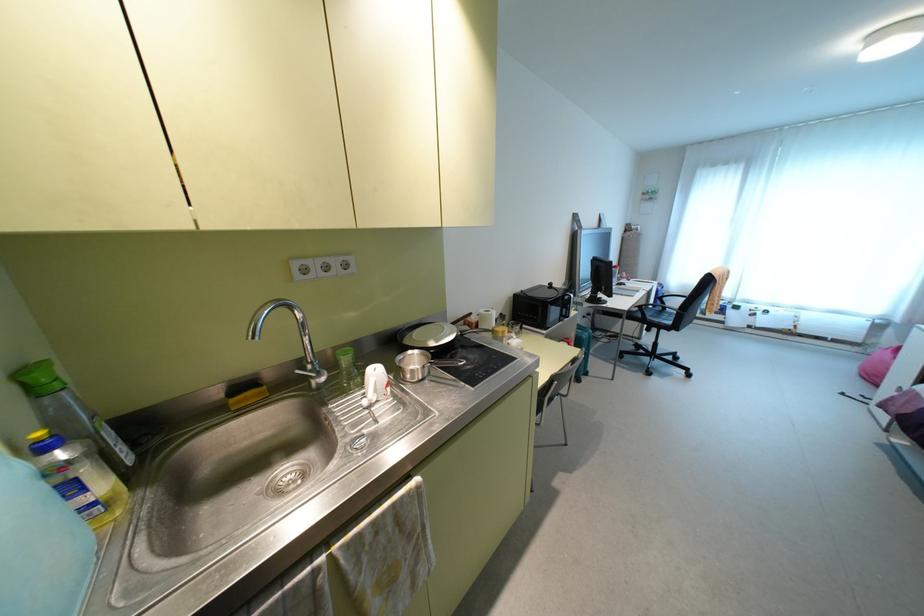
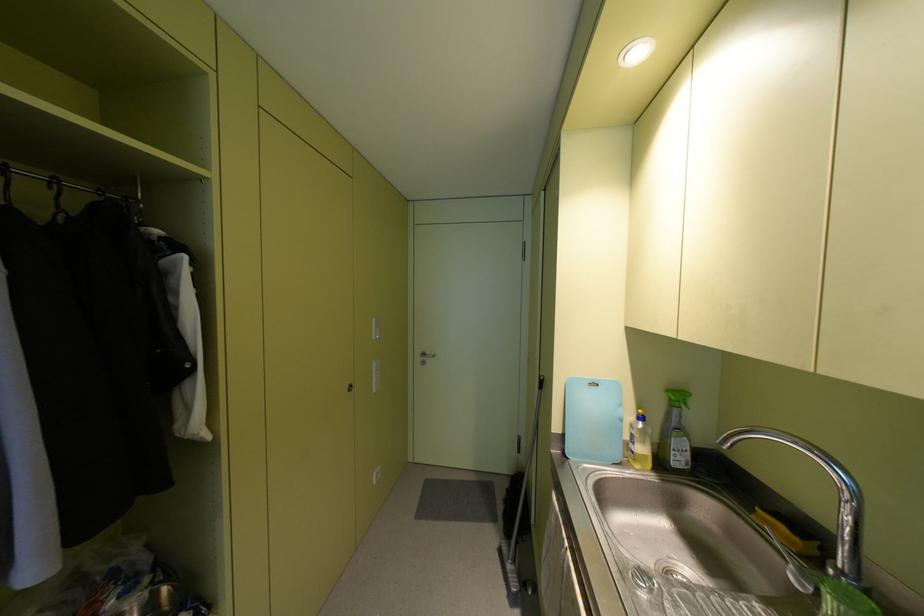
The point at [43,447] is marked in the first image. Where is the corresponding point in the second image?

(640, 416)